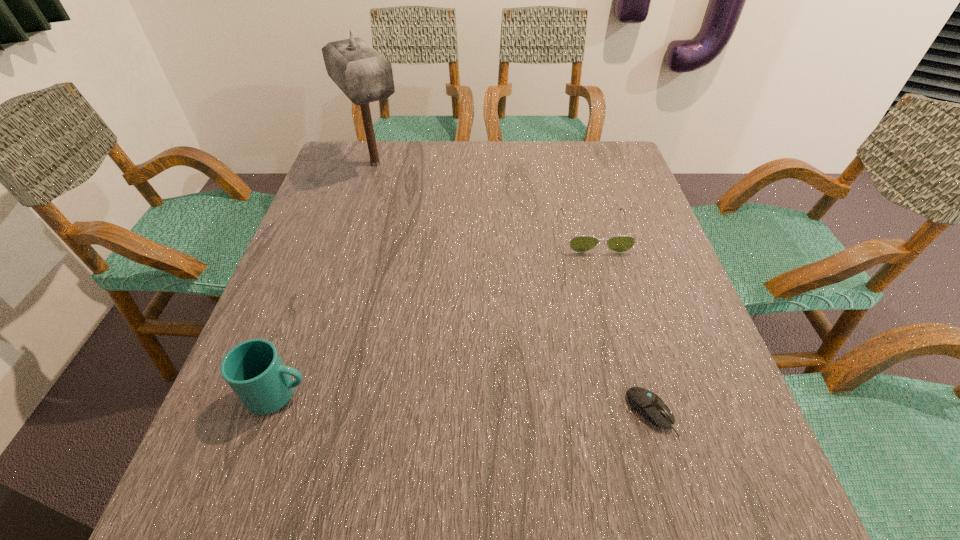
At what (x,y) coordinates should I click in order to perform the action: click on object positioned at the far edge. Please return your answer as a coordinate pair (x, y). The image size is (960, 540). Looking at the image, I should click on (363, 75).

Image resolution: width=960 pixels, height=540 pixels. Find the location of `mallet present at the left edge`. mallet present at the left edge is located at coordinates (363, 75).

Locate an element on the screen. cup present at the left edge is located at coordinates (254, 370).

Locate an element on the screen. The width and height of the screenshot is (960, 540). sunglasses that is at the right edge is located at coordinates (580, 244).

Find the location of `computer mouse that is at the right edge`. computer mouse that is at the right edge is located at coordinates (648, 404).

This screenshot has height=540, width=960. I want to click on object present at the far left corner, so click(x=363, y=75).

In the image, there is a desktop. Where is `free space at the far edge`? Image resolution: width=960 pixels, height=540 pixels. free space at the far edge is located at coordinates (536, 177).

Where is `vacant space at the near edge of the desktop`? The width and height of the screenshot is (960, 540). vacant space at the near edge of the desktop is located at coordinates (x=647, y=484).

This screenshot has width=960, height=540. Identify the location of free region at the left edge of the desktop. (318, 261).

Where is `vacant space at the right edge of the desktop`? This screenshot has height=540, width=960. vacant space at the right edge of the desktop is located at coordinates (694, 334).